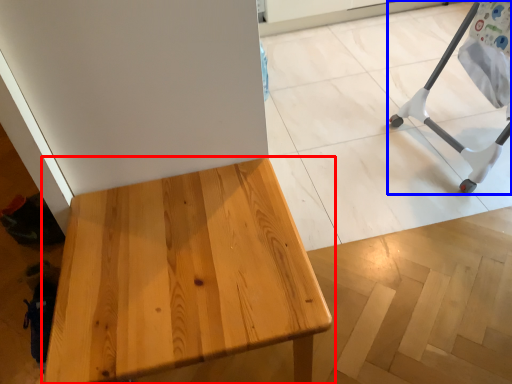
Question: Which point is further to the camera, table (highlighted by a red box) or furniture (highlighted by a blue box)?

Choices:
 (A) table
 (B) furniture

Answer: (B)